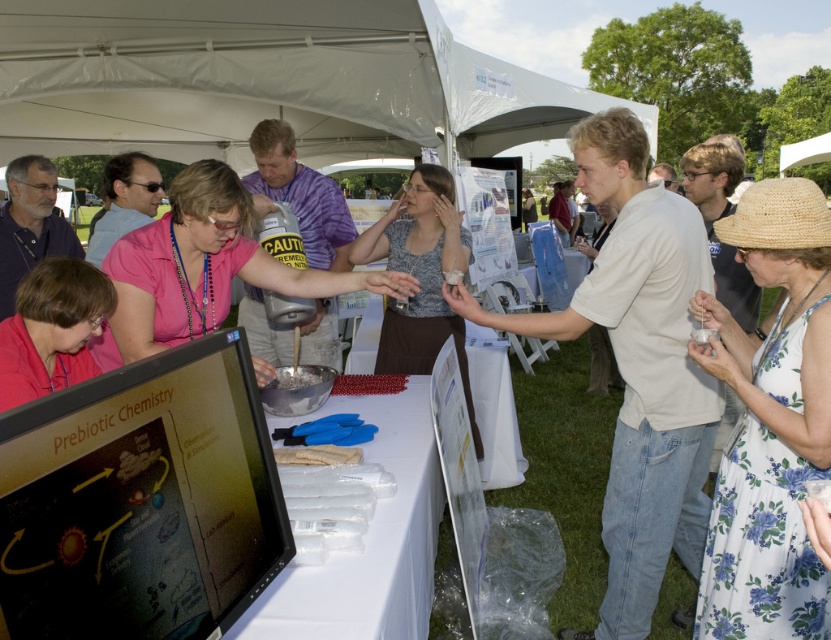
How far apart are white plastic table at center and strawmaterial/texturehat at right?

white plastic table at center and strawmaterial/texturehat at right are 4.21 feet apart from each other.

Where is `white plastic table at center`? This screenshot has height=640, width=831. white plastic table at center is located at coordinates (369, 541).

What do you see at coordinates (369, 541) in the screenshot?
I see `white plastic table at center` at bounding box center [369, 541].

The image size is (831, 640). Identify the location of white plastic table at center. (369, 541).

Between white plastic table at center and white crumbly substance at center, which one appears on the right side from the viewer's perspective?

From the viewer's perspective, white plastic table at center appears more on the right side.

Which is in front, point (396, 468) or point (323, 374)?

Point (396, 468) is more forward.

Is point (337, 568) positioned after point (327, 374)?

No, (337, 568) is closer to viewer.

This screenshot has width=831, height=640. I want to click on white plastic table at center, so click(369, 541).

Can you confirm if matte pink shirt at lower left is positioned to the right of strawmaterial/texturehat at right?

No, matte pink shirt at lower left is not to the right of strawmaterial/texturehat at right.

Between matte pink shirt at lower left and strawmaterial/texturehat at right, which one has more height?

matte pink shirt at lower left is taller.

You are a GUI agent. You are given a task and a screenshot of the screen. Output one action in this format:
    pyautogui.click(x=<x>, y=<y>)
    Task: Click on the matte pink shirt at lower left
    
    Given the screenshot: What is the action you would take?
    pos(52,330)